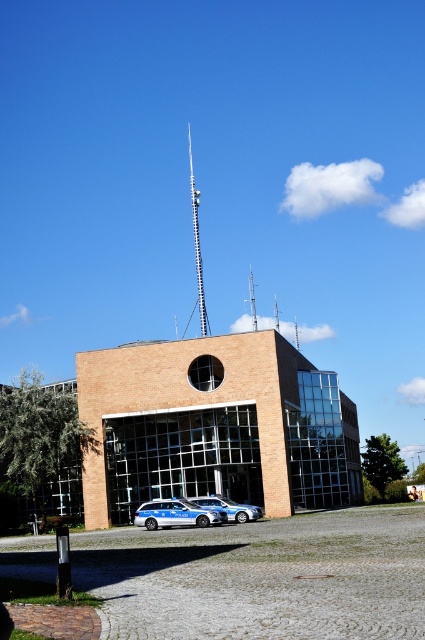
This screenshot has height=640, width=425. Describe the element at coordinates (197, 244) in the screenshot. I see `silver metallic tower at upper center` at that location.

Is point (201, 280) closer to camera compared to point (235, 504)?

No, it is not.

What are the coordinates of `silver metallic tower at upper center` in the screenshot? It's located at tap(197, 244).

Is point (193, 195) in front of point (249, 292)?

Yes, point (193, 195) is in front of point (249, 292).

Is the position of silver metallic tower at upper center less distant than that of metallic tower at center?

Yes, it is.

The image size is (425, 640). In order to click on silver metallic tower at upper center in this screenshot , I will do `click(197, 244)`.

The image size is (425, 640). In order to click on blue metallic car at center in this screenshot , I will do `click(229, 508)`.

Is point (217, 500) behind point (251, 314)?

No, (217, 500) is in front of (251, 314).

Locate an element on the screen. This screenshot has height=640, width=425. blue metallic car at center is located at coordinates (229, 508).